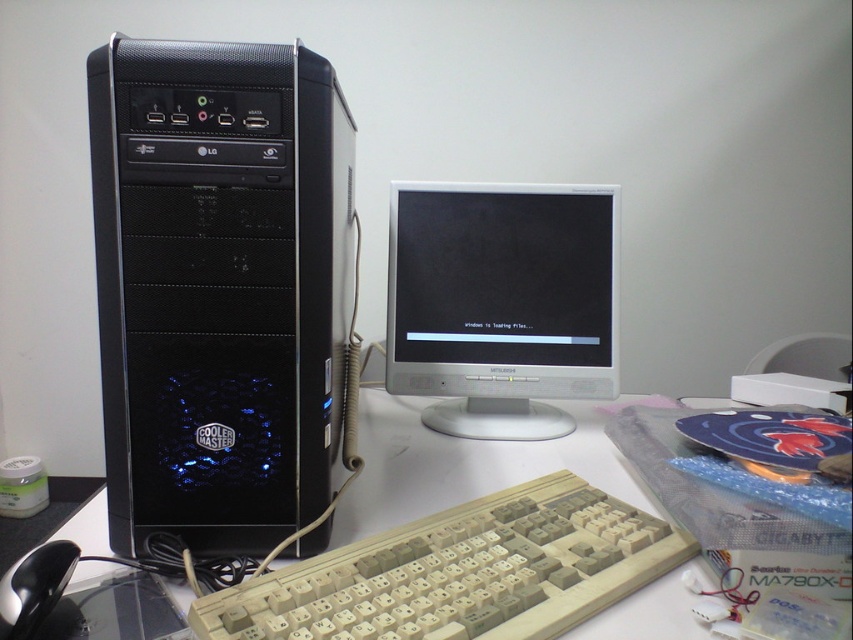
You are setting up a new computer desk and need to place a black matte tower at left and a black plastic mouse at lower left. According to the image, which object is positioned to the right of the other?

The black matte tower at left is positioned to the right of the black plastic mouse at lower left.

Looking at this image, you are setting up a new monitor stand and need to know the spatial relationship between the two points on the desk. Is point A at coordinates point (508, 554) located behind point B at coordinates point (70, 561)?

Yes, point A at coordinates point (508, 554) is located behind point B at coordinates point (70, 561).

You are setting up a new monitor and want to place it 18 inches away from the tower. Is the current distance between the black matte tower at left and the white glossy monitor at center sufficient for your requirement?

The black matte tower at left is 16.05 inches away from the white glossy monitor at center, which is less than the desired 18 inches. Therefore, the current distance is insufficient, and you would need to move the monitor further away to meet your requirement.